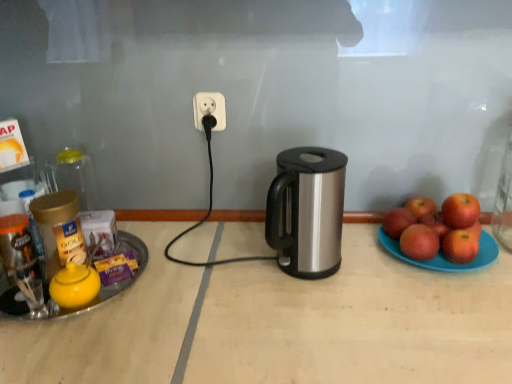
Find the location of a particular element. The width and height of the screenshot is (512, 384). red matte apple at right, which is counted as the fourth apple, starting from the front is located at coordinates (435, 224).

What do you see at coordinates (278, 324) in the screenshot?
I see `silver metallic kettle at center` at bounding box center [278, 324].

Where is `metallic gold jar at left, positioned as the second bottle in back-to-front order`? This screenshot has height=384, width=512. metallic gold jar at left, positioned as the second bottle in back-to-front order is located at coordinates [x=21, y=260].

How much space does metallic gold jar at left, positioned as the second bottle in back-to-front order, occupy vertically?

The height of metallic gold jar at left, positioned as the second bottle in back-to-front order, is 5.12 inches.

Measure the distance between point [74,194] and camera.

Point [74,194] and camera are 36.38 inches apart from each other.

The width and height of the screenshot is (512, 384). I want to click on red matte apple at right, the third apple from the back, so pyautogui.click(x=435, y=224).

Do you think red matte apple at right, positioned as the 5th apple in front-to-back order, is within red matte apple at right, placed as the sixth apple when sorted from front to back, or outside of it?

red matte apple at right, positioned as the 5th apple in front-to-back order, is outside red matte apple at right, placed as the sixth apple when sorted from front to back.

From a real-world perspective, is red matte apple at right, positioned as the 5th apple in front-to-back order, positioned above or below red matte apple at right, placed as the sixth apple when sorted from front to back?

Clearly, from a real-world perspective, red matte apple at right, positioned as the 5th apple in front-to-back order, is below red matte apple at right, placed as the sixth apple when sorted from front to back.

In order to click on the 1st apple above when counting from the red matte apple at right, positioned as the 5th apple in front-to-back order (from the image's perspective) in this screenshot , I will do [421, 206].

Considering the relative positions of gold plastic jar at left, the third bottle in the back-to-front sequence, and red matte apple at right, placed as the 1th apple when sorted from front to back, in the image provided, is gold plastic jar at left, the third bottle in the back-to-front sequence, to the left or to the right of red matte apple at right, placed as the 1th apple when sorted from front to back,?

gold plastic jar at left, the third bottle in the back-to-front sequence, is to the left of red matte apple at right, placed as the 1th apple when sorted from front to back.

Considering the relative sizes of gold plastic jar at left, which appears as the 1th bottle when viewed from the front, and red matte apple at right, placed as the 1th apple when sorted from front to back, in the image provided, is gold plastic jar at left, which appears as the 1th bottle when viewed from the front, shorter than red matte apple at right, placed as the 1th apple when sorted from front to back,?

No, gold plastic jar at left, which appears as the 1th bottle when viewed from the front, is not shorter than red matte apple at right, placed as the 1th apple when sorted from front to back.

Based on the photo, is gold plastic jar at left, the third bottle in the back-to-front sequence, further to the viewer compared to red matte apple at right, placed as the 1th apple when sorted from front to back?

No, gold plastic jar at left, the third bottle in the back-to-front sequence, is closer to the camera.

In the scene shown: From a real-world perspective, who is located higher, gold plastic jar at left, which appears as the 1th bottle when viewed from the front, or red matte apple at right, the sixth apple positioned from the back?

gold plastic jar at left, which appears as the 1th bottle when viewed from the front, from a real-world perspective.

What's the angular difference between red matte apple at right, which is counted as the 2th apple, starting from the front, and blue plastic plate at right's facing directions?

The facing directions of red matte apple at right, which is counted as the 2th apple, starting from the front, and blue plastic plate at right are 1.13 degrees apart.

Consider the image. Can you confirm if red matte apple at right, the 5th apple in the back-to-front sequence, is taller than blue plastic plate at right?

Yes.

Measure the distance between red matte apple at right, which is counted as the 2th apple, starting from the front, and blue plastic plate at right.

2.22 inches.

From the image's perspective, relative to blue plastic plate at right, is red matte apple at right, the 5th apple in the back-to-front sequence, above or below?

From the image's perspective, red matte apple at right, the 5th apple in the back-to-front sequence, appears above blue plastic plate at right.

From the image's perspective, which is below, transparent glass jar at left, positioned as the 1th bottle in back-to-front order, or red matte apple at right, the fourth apple when ordered from back to front?

red matte apple at right, the fourth apple when ordered from back to front.

Based on the photo, can you tell me how much transparent glass jar at left, arranged as the third bottle when viewed from the front, and red matte apple at right, the fourth apple when ordered from back to front, differ in facing direction?

transparent glass jar at left, arranged as the third bottle when viewed from the front, and red matte apple at right, the fourth apple when ordered from back to front, are facing 90.9 degrees away from each other.

How far apart are transparent glass jar at left, arranged as the third bottle when viewed from the front, and red matte apple at right, which appears as the 3th apple when viewed from the front?

transparent glass jar at left, arranged as the third bottle when viewed from the front, and red matte apple at right, which appears as the 3th apple when viewed from the front, are 93.86 centimeters apart.

At what (x,y) coordinates should I click in order to perform the action: click on bottle that is the 1st one below the red matte apple at right, the fourth apple when ordered from back to front (from a real-world perspective). Please return your answer as a coordinate pair (x, y). This screenshot has height=384, width=512. Looking at the image, I should click on (76, 177).

Is red matte apple at right, placed as the 1th apple when sorted from front to back, surrounding gold plastic jar at left, the third bottle in the back-to-front sequence?

No, gold plastic jar at left, the third bottle in the back-to-front sequence, is not a part of red matte apple at right, placed as the 1th apple when sorted from front to back.

Based on the photo, is red matte apple at right, placed as the 1th apple when sorted from front to back, not near gold plastic jar at left, which appears as the 1th bottle when viewed from the front?

No, there isn't a large distance between red matte apple at right, placed as the 1th apple when sorted from front to back, and gold plastic jar at left, which appears as the 1th bottle when viewed from the front.

How different are the orientations of red matte apple at right, placed as the 1th apple when sorted from front to back, and gold plastic jar at left, the third bottle in the back-to-front sequence, in degrees?

They differ by 60.4 degrees in their facing directions.

From a real-world perspective, is red matte apple at right, the sixth apple positioned from the back, below gold plastic jar at left, the third bottle in the back-to-front sequence?

Yes, from a real-world perspective, red matte apple at right, the sixth apple positioned from the back, is below gold plastic jar at left, the third bottle in the back-to-front sequence.

From a real-world perspective, which apple is the 1st one above the red matte apple at right, which is counted as the 2th apple, starting from the front? Please provide its 2D coordinates.

[(421, 206)]

Would you say red matte apple at right, which is counted as the 2th apple, starting from the front, contains red matte apple at right, placed as the sixth apple when sorted from front to back?

No.

Is red matte apple at right, which is counted as the 2th apple, starting from the front, next to red matte apple at right, which appears as the first apple when viewed from the back, and touching it?

No, red matte apple at right, which is counted as the 2th apple, starting from the front, is not touching red matte apple at right, which appears as the first apple when viewed from the back.

Could you tell me if red matte apple at right, the 5th apple in the back-to-front sequence, is turned towards red matte apple at right, placed as the sixth apple when sorted from front to back?

No, red matte apple at right, the 5th apple in the back-to-front sequence, is not facing towards red matte apple at right, placed as the sixth apple when sorted from front to back.

Who is smaller, gold plastic jar at left, which appears as the 1th bottle when viewed from the front, or red matte apple at right, the third apple from the back?

With smaller size is red matte apple at right, the third apple from the back.

From a real-world perspective, is gold plastic jar at left, which appears as the 1th bottle when viewed from the front, located higher than red matte apple at right, which is counted as the fourth apple, starting from the front?

Yes, from a real-world perspective, gold plastic jar at left, which appears as the 1th bottle when viewed from the front, is above red matte apple at right, which is counted as the fourth apple, starting from the front.

How distant is gold plastic jar at left, the third bottle in the back-to-front sequence, from red matte apple at right, the third apple from the back?

gold plastic jar at left, the third bottle in the back-to-front sequence, is 31.88 inches from red matte apple at right, the third apple from the back.

From the image's perspective, is gold plastic jar at left, which appears as the 1th bottle when viewed from the front, beneath red matte apple at right, the third apple from the back?

Yes, from the image's perspective, gold plastic jar at left, which appears as the 1th bottle when viewed from the front, is beneath red matte apple at right, the third apple from the back.

Find the location of a particular element. This screenshot has height=384, width=512. the 1st apple in front of the red matte apple at right, placed as the sixth apple when sorted from front to back, counting from the anchor's position is located at coordinates (398, 222).

From the image's perspective, starting from the gold plastic jar at left, which appears as the 1th bottle when viewed from the front, which apple is the 2nd one below? Please provide its 2D coordinates.

[(460, 245)]

When comparing their distances from red matte apple at right, arranged as the second apple when viewed from the back, does blue plastic plate at right or red matte apple at right, which appears as the first apple when viewed from the back, seem closer?

red matte apple at right, which appears as the first apple when viewed from the back, is closer to red matte apple at right, arranged as the second apple when viewed from the back.

Estimate the real-world distances between objects in this image. Which object is further from metallic gold jar at left, which is the second bottle from front to back, white plastic power outlet at center or red matte apple at right, arranged as the second apple when viewed from the back?

The object further to metallic gold jar at left, which is the second bottle from front to back, is red matte apple at right, arranged as the second apple when viewed from the back.

Estimate the real-world distances between objects in this image. Which object is closer to red matte apple at right, the fourth apple when ordered from back to front, silver metallic kettle at center or transparent glass jar at left, arranged as the third bottle when viewed from the front?

silver metallic kettle at center.

From the image, which object appears to be farther from silver metallic kettle at center, red matte apple at right, which is counted as the 2th apple, starting from the front, or metallic gold jar at left, which is the second bottle from front to back?

metallic gold jar at left, which is the second bottle from front to back, is positioned further to the anchor silver metallic kettle at center.

Looking at the image, which one is located further to red matte apple at right, positioned as the 5th apple in front-to-back order, silver metallic kettle at center or white plastic power outlet at center?

white plastic power outlet at center.

Looking at the image, which one is located further to red matte apple at right, positioned as the 5th apple in front-to-back order, silver metallic kettle at center or transparent glass jar at left, positioned as the 1th bottle in back-to-front order?

Based on the image, transparent glass jar at left, positioned as the 1th bottle in back-to-front order, appears to be further to red matte apple at right, positioned as the 5th apple in front-to-back order.

Consider the image. Looking at the image, which one is located closer to red matte apple at right, which appears as the first apple when viewed from the back, transparent glass jar at left, arranged as the third bottle when viewed from the front, or metallic gold jar at left, which is the second bottle from front to back?

transparent glass jar at left, arranged as the third bottle when viewed from the front, is positioned closer to the anchor red matte apple at right, which appears as the first apple when viewed from the back.

Estimate the real-world distances between objects in this image. Which object is further from red matte apple at right, the 5th apple in the back-to-front sequence, white plastic power outlet at center or silver metallic kettle at center?

Among the two, white plastic power outlet at center is located further to red matte apple at right, the 5th apple in the back-to-front sequence.

The image size is (512, 384). In order to click on glass plate between white plastic power outlet at center and red matte apple at right, the fourth apple when ordered from back to front, from left to right in this screenshot , I will do `click(445, 257)`.

Find the location of `apple between metallic gold jar at left, positioned as the second bottle in back-to-front order, and red matte apple at right, which is counted as the 2th apple, starting from the front`. apple between metallic gold jar at left, positioned as the second bottle in back-to-front order, and red matte apple at right, which is counted as the 2th apple, starting from the front is located at coordinates (398, 222).

The height and width of the screenshot is (384, 512). I want to click on kitchen appliance located between gold plastic jar at left, which appears as the 1th bottle when viewed from the front, and red matte apple at right, the 5th apple in the back-to-front sequence, in the left-right direction, so click(x=307, y=211).

I want to click on glass plate between red matte apple at right, placed as the 1th apple when sorted from front to back, and silver metallic kettle at center in the up-down direction, so click(x=445, y=257).